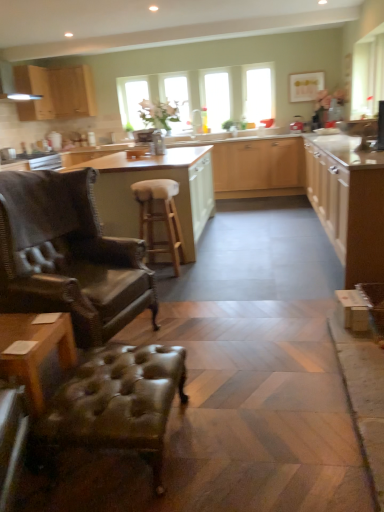
Question: Is matte wood cabinetry at center, which ranks as the 3th cabinetry in left-to-right order, surrounded by transparent glass window at upper center, which ranks as the 2th window in left-to-right order?

Choices:
 (A) no
 (B) yes

Answer: (A)

Question: Is transparent glass window at upper center, which ranks as the 2th window in left-to-right order, oriented away from matte wood cabinetry at center, which ranks as the 3th cabinetry in left-to-right order?

Choices:
 (A) no
 (B) yes

Answer: (A)

Question: Considering the relative sizes of transparent glass window at upper center, positioned as the 1th window in right-to-left order, and matte wood cabinetry at center, which is the second cabinetry from right to left, in the image provided, is transparent glass window at upper center, positioned as the 1th window in right-to-left order, smaller than matte wood cabinetry at center, which is the second cabinetry from right to left,?

Choices:
 (A) no
 (B) yes

Answer: (B)

Question: From the image's perspective, does transparent glass window at upper center, which ranks as the 2th window in left-to-right order, appear lower than matte wood cabinetry at center, which ranks as the 3th cabinetry in left-to-right order?

Choices:
 (A) yes
 (B) no

Answer: (B)

Question: Considering the relative sizes of transparent glass window at upper center, positioned as the 1th window in right-to-left order, and matte wood cabinetry at center, which ranks as the 3th cabinetry in left-to-right order, in the image provided, is transparent glass window at upper center, positioned as the 1th window in right-to-left order, thinner than matte wood cabinetry at center, which ranks as the 3th cabinetry in left-to-right order,?

Choices:
 (A) no
 (B) yes

Answer: (B)

Question: Can you confirm if transparent glass window at upper center, positioned as the 1th window in right-to-left order, is positioned to the left of matte wood cabinetry at center, which ranks as the 3th cabinetry in left-to-right order?

Choices:
 (A) no
 (B) yes

Answer: (A)

Question: Could you tell me if leather tufted ottoman at lower left is facing matte wood cabinetry at center, which is the second cabinetry from right to left?

Choices:
 (A) no
 (B) yes

Answer: (A)

Question: Is leather tufted ottoman at lower left at the left side of matte wood cabinetry at center, which is the second cabinetry from right to left?

Choices:
 (A) no
 (B) yes

Answer: (A)

Question: From the image's perspective, is leather tufted ottoman at lower left located above matte wood cabinetry at center, which is the second cabinetry from right to left?

Choices:
 (A) no
 (B) yes

Answer: (A)

Question: Is leather tufted ottoman at lower left positioned in front of matte wood cabinetry at center, which ranks as the 3th cabinetry in left-to-right order?

Choices:
 (A) no
 (B) yes

Answer: (B)

Question: Is leather tufted ottoman at lower left wider than matte wood cabinetry at center, which ranks as the 3th cabinetry in left-to-right order?

Choices:
 (A) no
 (B) yes

Answer: (A)

Question: Does leather tufted ottoman at lower left lie behind matte wood cabinetry at center, which ranks as the 3th cabinetry in left-to-right order?

Choices:
 (A) no
 (B) yes

Answer: (A)

Question: Is the position of clear glass window at center, positioned as the 1th window screen in left-to-right order, more distant than that of matte wood cabinetry at center, which is the second cabinetry from right to left?

Choices:
 (A) no
 (B) yes

Answer: (B)